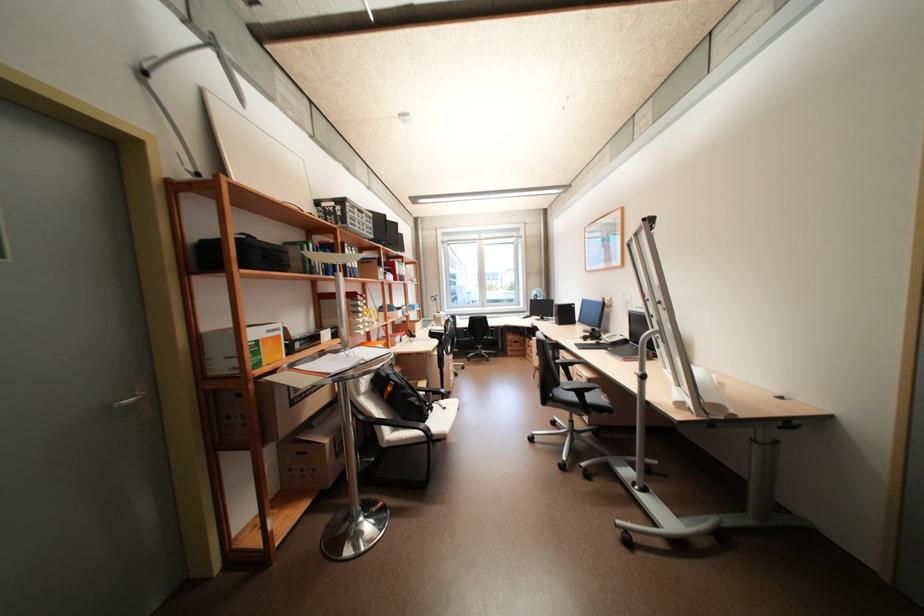
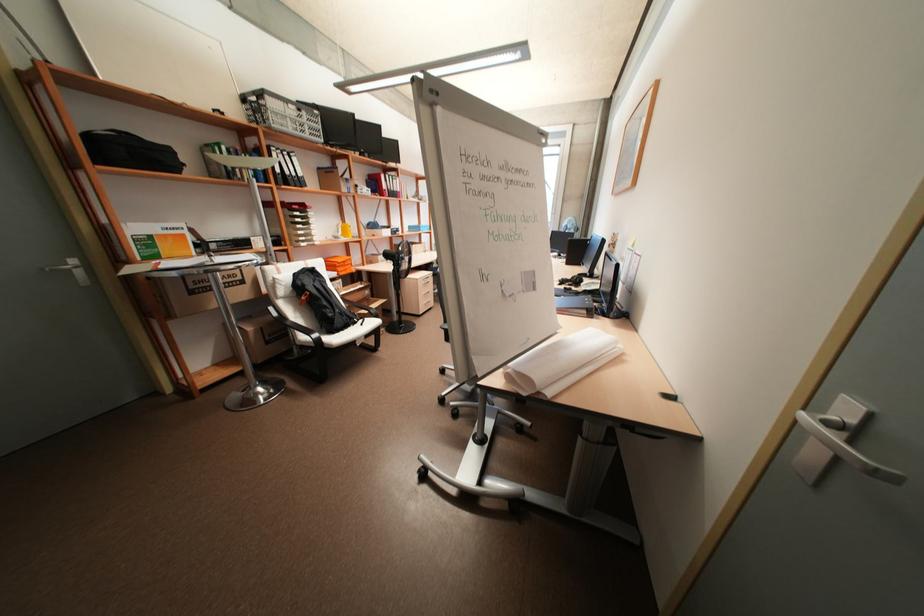
Question: What movement of the cameraman would produce the second image?

Choices:
 (A) Left
 (B) Right
 (C) Forward
 (D) Backward

Answer: (B)